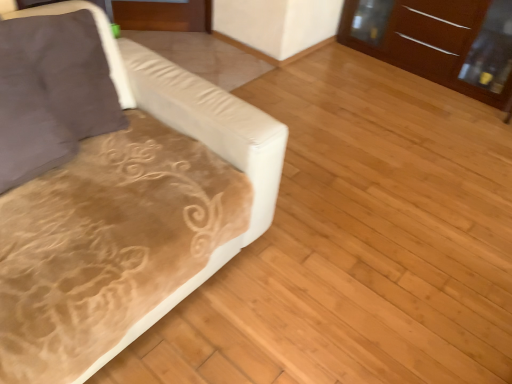
Question: Can you confirm if brown glossy dresser at upper right is thinner than suede-like brown pillow at left?

Choices:
 (A) no
 (B) yes

Answer: (A)

Question: From a real-world perspective, is brown glossy dresser at upper right physically below suede-like brown pillow at left?

Choices:
 (A) no
 (B) yes

Answer: (B)

Question: From a real-world perspective, does brown glossy dresser at upper right stand above suede-like brown pillow at left?

Choices:
 (A) no
 (B) yes

Answer: (A)

Question: Is brown glossy dresser at upper right bigger than suede-like brown pillow at left?

Choices:
 (A) yes
 (B) no

Answer: (A)

Question: Can you confirm if brown glossy dresser at upper right is wider than suede-like brown pillow at left?

Choices:
 (A) no
 (B) yes

Answer: (B)

Question: Is brown glossy dresser at upper right looking in the opposite direction of suede-like brown pillow at left?

Choices:
 (A) no
 (B) yes

Answer: (A)

Question: From the image's perspective, is velvet beige couch at left below brown glossy dresser at upper right?

Choices:
 (A) no
 (B) yes

Answer: (B)

Question: Does velvet beige couch at left have a lesser height compared to brown glossy dresser at upper right?

Choices:
 (A) no
 (B) yes

Answer: (A)

Question: From the image's perspective, does velvet beige couch at left appear higher than brown glossy dresser at upper right?

Choices:
 (A) yes
 (B) no

Answer: (B)

Question: Does velvet beige couch at left have a greater height compared to brown glossy dresser at upper right?

Choices:
 (A) yes
 (B) no

Answer: (A)

Question: Is velvet beige couch at left positioned beyond the bounds of brown glossy dresser at upper right?

Choices:
 (A) no
 (B) yes

Answer: (B)

Question: Would you consider velvet beige couch at left to be distant from brown glossy dresser at upper right?

Choices:
 (A) yes
 (B) no

Answer: (A)

Question: Is suede-like brown pillow at left turned away from velvet beige couch at left?

Choices:
 (A) yes
 (B) no

Answer: (A)